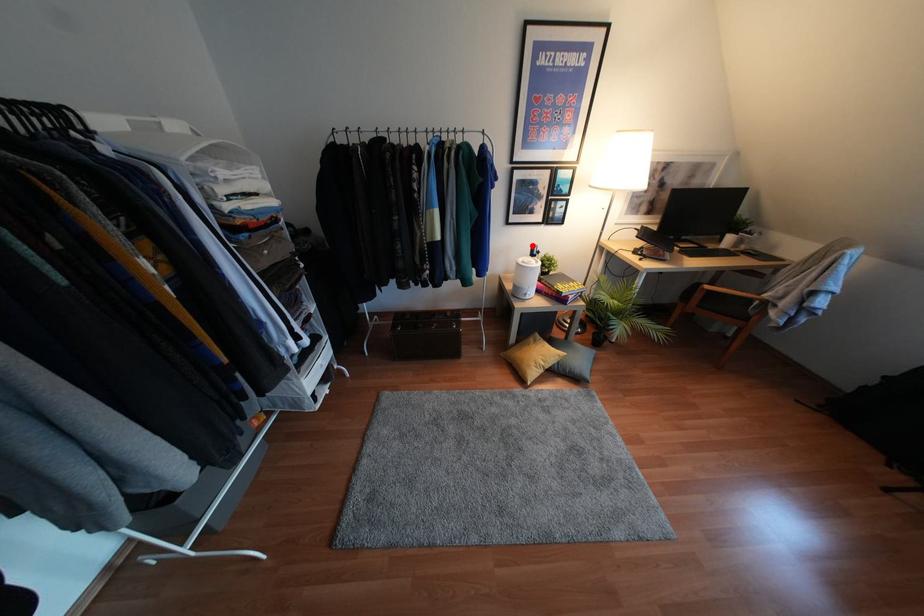
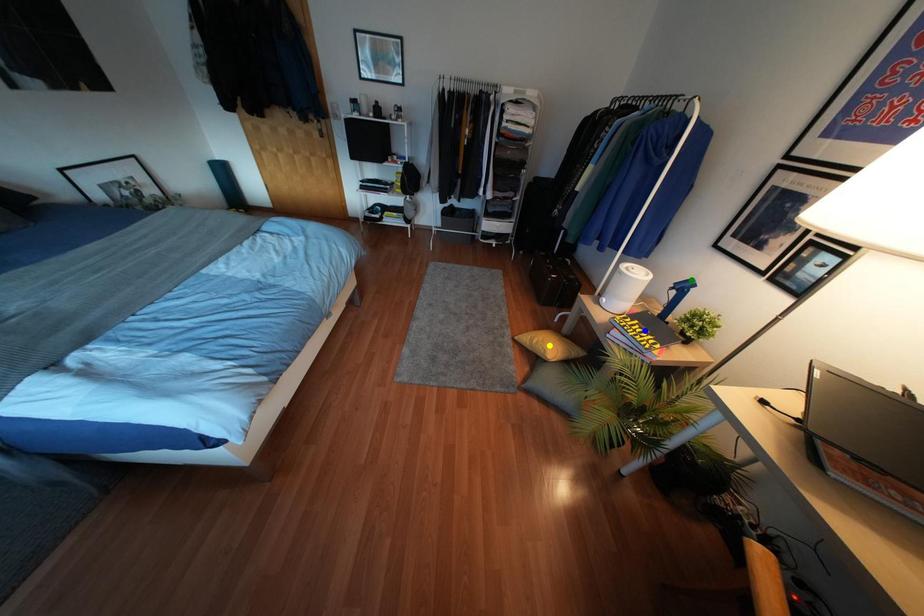
Question: I am providing you with two images of the same scene from different viewpoints. A red point is marked on the first image. You are given multiple points on the second image. Which point in image 2 represents the same 3d spot as the red point in image 1?

Choices:
 (A) green point
 (B) yellow point
 (C) blue point

Answer: (A)